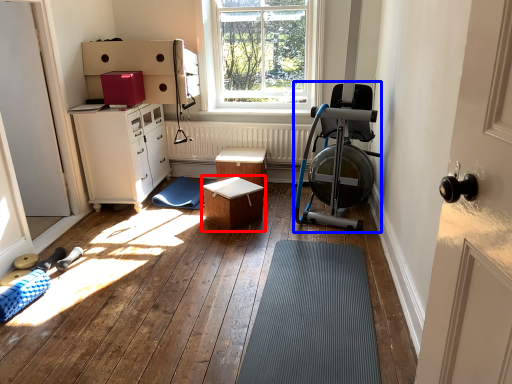
Question: Among these objects, which one is farthest to the camera, table (highlighted by a red box) or baby carriage (highlighted by a blue box)?

Choices:
 (A) table
 (B) baby carriage

Answer: (A)